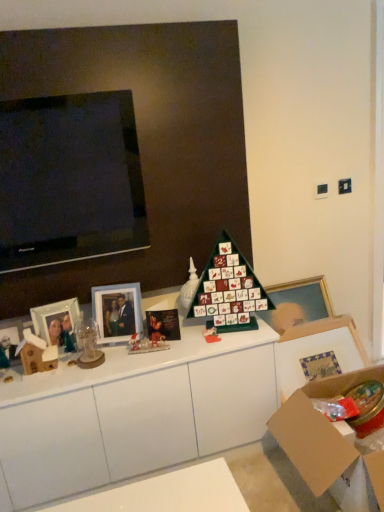
Where is `vacant area that is situated to the right of glossy paper christmas card at center`? The width and height of the screenshot is (384, 512). vacant area that is situated to the right of glossy paper christmas card at center is located at coordinates (200, 334).